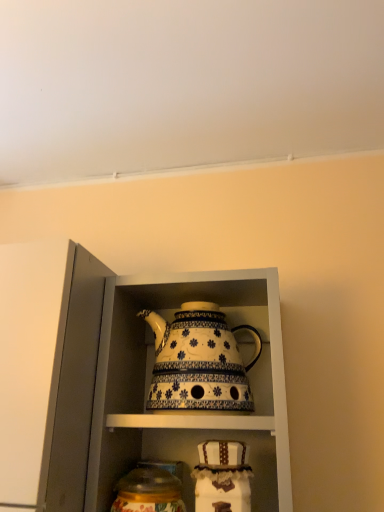
Question: Is white glossy teapot at center in front of matte glass jar at lower center?

Choices:
 (A) no
 (B) yes

Answer: (B)

Question: Is white glossy teapot at center further to the viewer compared to matte glass jar at lower center?

Choices:
 (A) yes
 (B) no

Answer: (B)

Question: Is white glossy teapot at center oriented towards matte glass jar at lower center?

Choices:
 (A) yes
 (B) no

Answer: (B)

Question: Considering the relative sizes of white glossy teapot at center and matte glass jar at lower center in the image provided, is white glossy teapot at center taller than matte glass jar at lower center?

Choices:
 (A) yes
 (B) no

Answer: (A)

Question: From a real-world perspective, is white glossy teapot at center located beneath matte glass jar at lower center?

Choices:
 (A) yes
 (B) no

Answer: (B)

Question: From the image's perspective, does white glossy teapot at center appear higher than matte glass jar at lower center?

Choices:
 (A) yes
 (B) no

Answer: (A)

Question: Is white ceramic teapot at center placed right next to matte glass jar at lower center?

Choices:
 (A) yes
 (B) no

Answer: (B)

Question: From the image's perspective, is white ceramic teapot at center located above matte glass jar at lower center?

Choices:
 (A) no
 (B) yes

Answer: (B)

Question: Is white ceramic teapot at center oriented away from matte glass jar at lower center?

Choices:
 (A) no
 (B) yes

Answer: (A)

Question: Is the depth of white ceramic teapot at center less than that of matte glass jar at lower center?

Choices:
 (A) yes
 (B) no

Answer: (B)

Question: From the image's perspective, is white ceramic teapot at center under matte glass jar at lower center?

Choices:
 (A) no
 (B) yes

Answer: (A)

Question: Does white ceramic teapot at center have a lesser height compared to matte glass jar at lower center?

Choices:
 (A) no
 (B) yes

Answer: (A)

Question: Is white ceramic teapot at center taller than white glossy teapot at center?

Choices:
 (A) no
 (B) yes

Answer: (A)